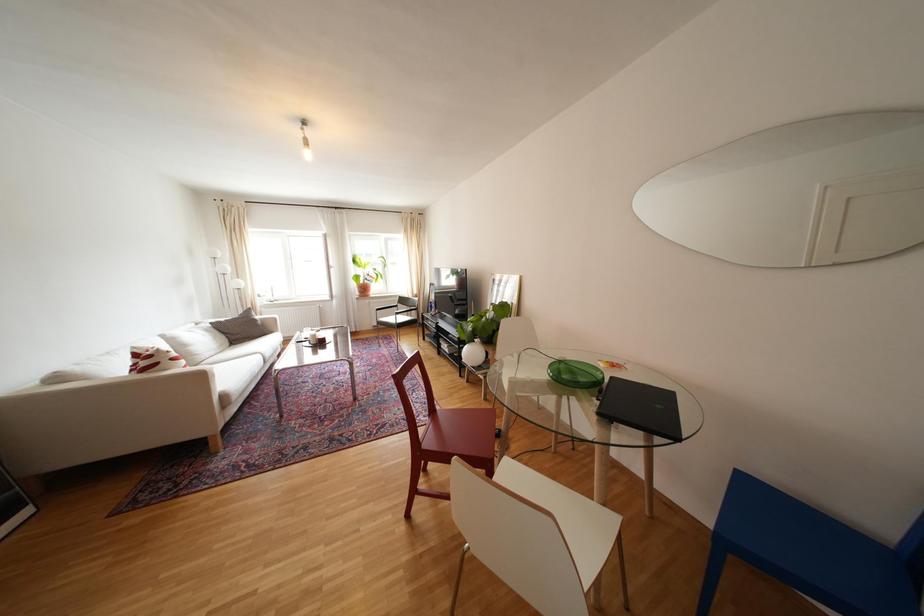
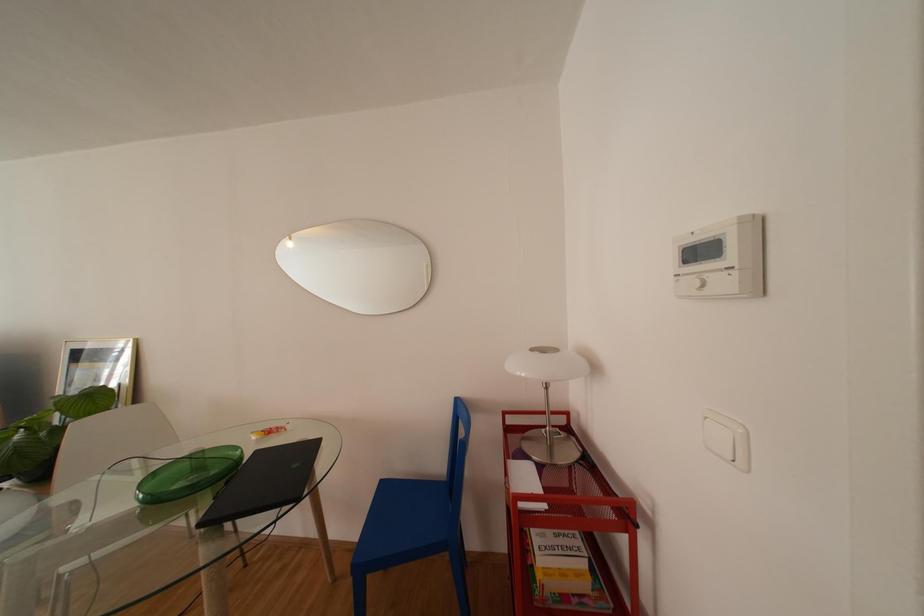
Question: The first image is from the beginning of the video and the second image is from the end. How did the camera likely rotate when shooting the video?

Choices:
 (A) Left
 (B) Right
 (C) Up
 (D) Down

Answer: (B)